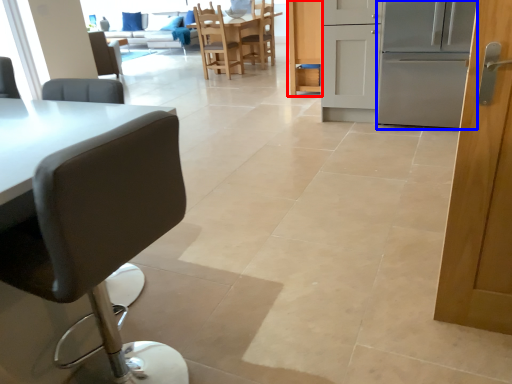
Question: Which object appears closest to the camera in this image, cabinetry (highlighted by a red box) or oven (highlighted by a blue box)?

Choices:
 (A) cabinetry
 (B) oven

Answer: (B)